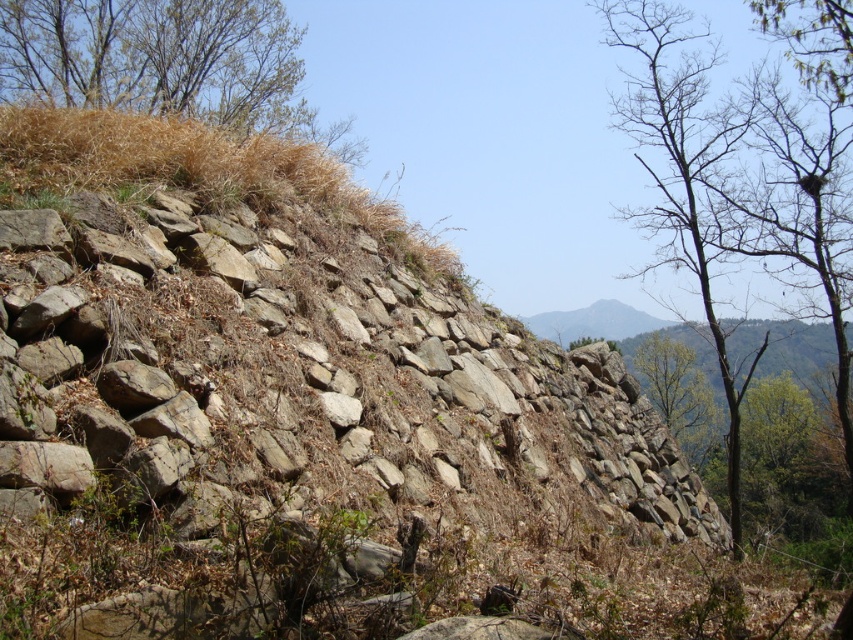
Question: Which object appears farthest from the camera in this image?

Choices:
 (A) brown grass at upper left
 (B) bare branches at upper right

Answer: (A)

Question: Does bare branches at upper right appear on the left side of green leafy tree at upper right?

Choices:
 (A) yes
 (B) no

Answer: (A)

Question: Does bare branches at upper right have a lesser width compared to green leafy tree at upper right?

Choices:
 (A) no
 (B) yes

Answer: (A)

Question: Considering the real-world distances, which object is closest to the green leafy tree at upper right?

Choices:
 (A) bare branches at upper right
 (B) brown grass at upper left

Answer: (A)

Question: Which object is positioned closest to the bare branches at upper right?

Choices:
 (A) green leafy tree at upper right
 (B) brown grass at upper left

Answer: (A)

Question: Is bare branches at upper right positioned behind green leafy tree at upper right?

Choices:
 (A) yes
 (B) no

Answer: (B)